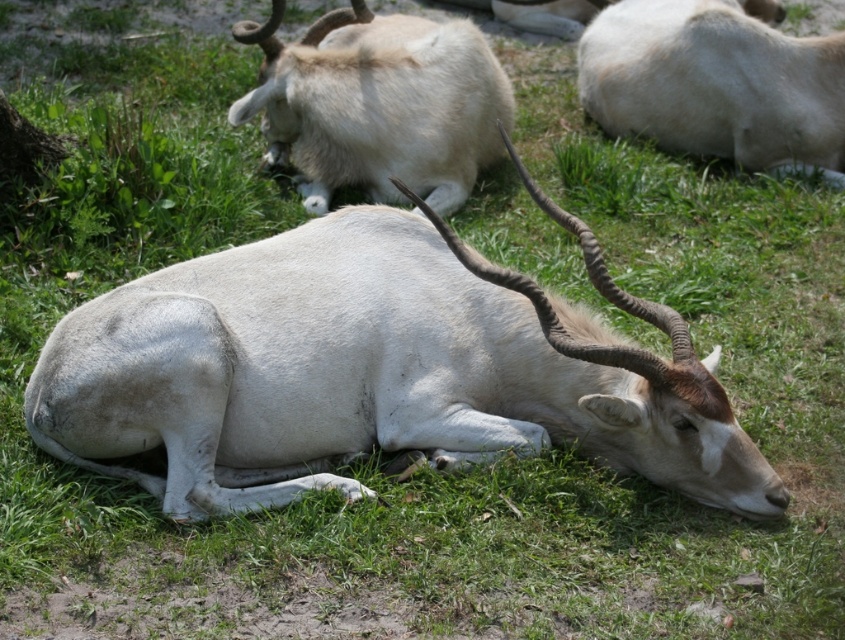
Question: Which of the following is the farthest from the observer?

Choices:
 (A) (273, 483)
 (B) (706, 100)
 (C) (424, 118)

Answer: (B)

Question: In this image, where is white matte antelope at center located relative to white woolly antelope at upper center?

Choices:
 (A) left
 (B) right

Answer: (B)

Question: Which object is farther from the camera taking this photo?

Choices:
 (A) white matte antelope at center
 (B) white woolly antelope at upper center

Answer: (B)

Question: Among these points, which one is farthest from the camera?

Choices:
 (A) (766, 60)
 (B) (383, 65)
 (C) (118, 406)

Answer: (A)

Question: Does white woolly antelope at upper center appear under white woolly antelope at upper right?

Choices:
 (A) no
 (B) yes

Answer: (B)

Question: Can you confirm if white matte antelope at center is positioned above white woolly antelope at upper right?

Choices:
 (A) no
 (B) yes

Answer: (A)